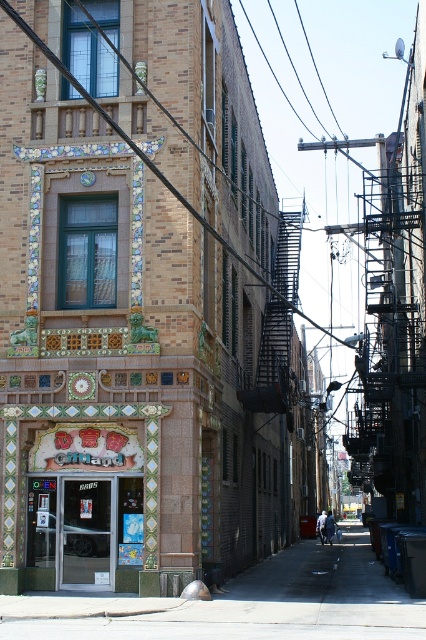
You are standing at the entrance of the Chinatown storefront and want to walk to the concrete sidewalk at lower center. According to the coordinates provided, in which direction should you move relative to the storefront entrance?

The concrete sidewalk at lower center is located at coordinates point (247, 604). Since the entrance is part of the storefront on the ground floor, moving towards the lower center direction would mean heading forward or straight ahead from the entrance to reach the concrete sidewalk at lower center.

You are a street vendor setting up a food cart. You need to park it on the concrete sidewalk at lower center near the matte green tile storefront at center. Will the sidewalk be wide enough for your cart, which is 2 meters wide?

The concrete sidewalk at lower center is wider than the matte green tile storefront at center. Since the sidewalk is wider, it should accommodate a 2 meter wide cart, provided there are no other obstructions.